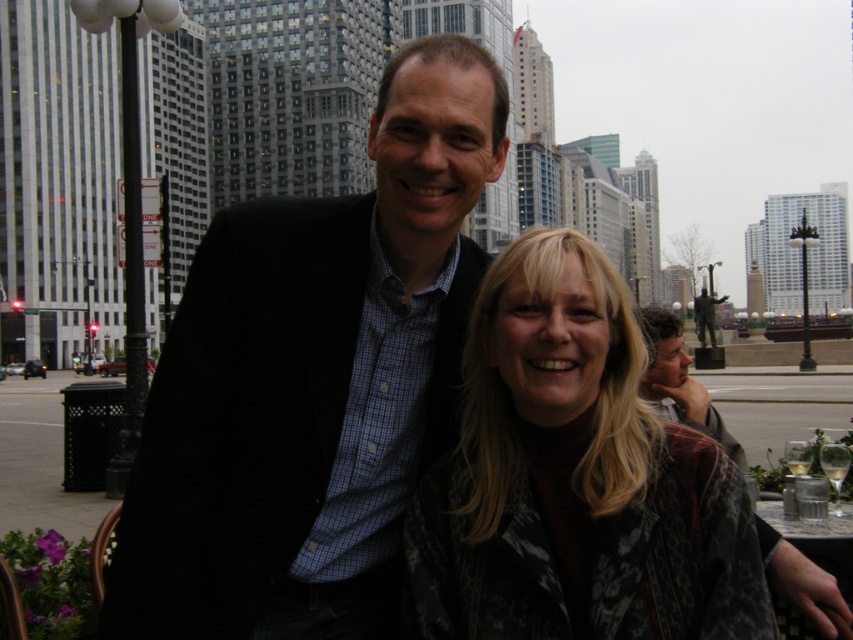
Can you confirm if patterned fabric jacket at center is taller than matte black jacket at center?

Yes, patterned fabric jacket at center is taller than matte black jacket at center.

Which is more to the right, patterned fabric jacket at center or matte black jacket at center?

Positioned to the right is matte black jacket at center.

What do you see at coordinates (575, 477) in the screenshot?
I see `patterned fabric jacket at center` at bounding box center [575, 477].

Find the location of `patterned fabric jacket at center`. patterned fabric jacket at center is located at coordinates (575, 477).